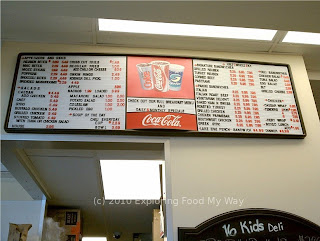
Locate an element on the screen. The width and height of the screenshot is (320, 241). box is located at coordinates (71, 227).